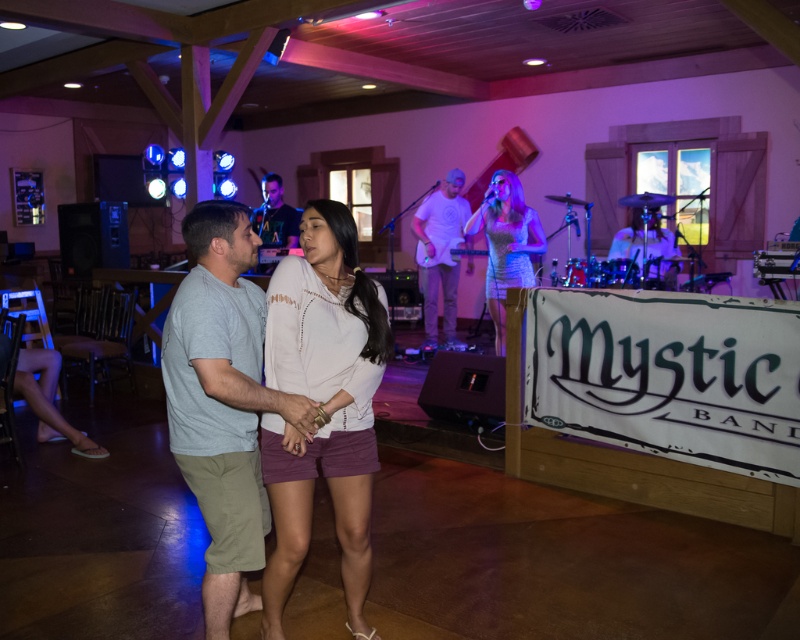
Between white matte shirt at center and shiny silver dress at center, which one is positioned higher?

shiny silver dress at center

Between white matte shirt at center and shiny silver dress at center, which one has more height?

white matte shirt at center

The height and width of the screenshot is (640, 800). What do you see at coordinates (322, 404) in the screenshot?
I see `white matte shirt at center` at bounding box center [322, 404].

You are a GUI agent. You are given a task and a screenshot of the screen. Output one action in this format:
    pyautogui.click(x=<x>, y=<y>)
    Task: Click on the white matte shirt at center
    The width and height of the screenshot is (800, 640).
    Given the screenshot: What is the action you would take?
    pyautogui.click(x=322, y=404)

Does white matte shirt at center have a greater height compared to matte black shirt at center?

Yes.

Is white matte shirt at center further to the viewer compared to matte black shirt at center?

That is False.

Does point (329, 340) lie behind point (292, 212)?

No, it is not.

Where is `white matte shirt at center`? This screenshot has width=800, height=640. white matte shirt at center is located at coordinates (322, 404).

Is shiny silver dress at center thinner than matte white shirt at center?

No.

Image resolution: width=800 pixels, height=640 pixels. What do you see at coordinates (505, 243) in the screenshot?
I see `shiny silver dress at center` at bounding box center [505, 243].

Between point (492, 268) and point (436, 264), which one is positioned behind?

Point (436, 264)

What are the coordinates of `shiny silver dress at center` in the screenshot? It's located at (505, 243).